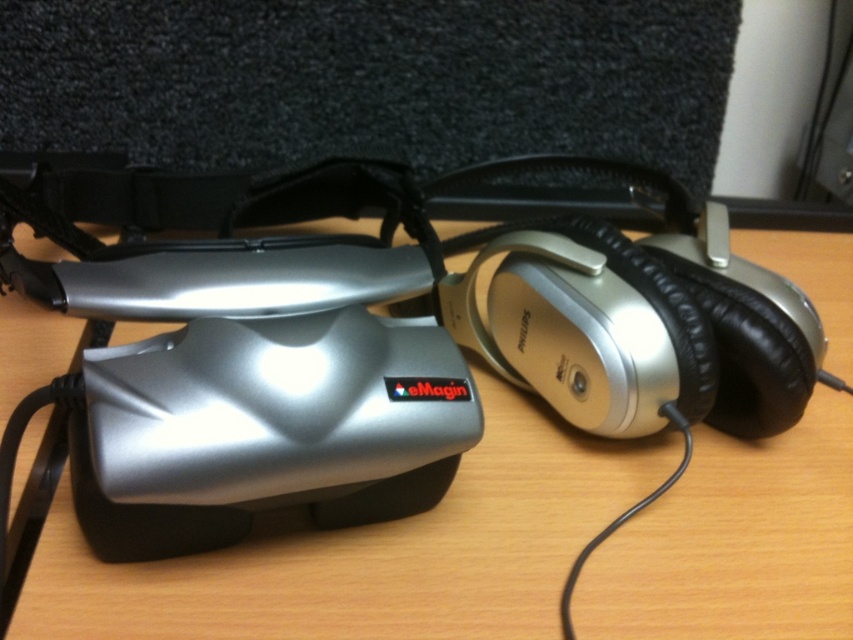
Question: Observing the image, what is the correct spatial positioning of wooden table at center in reference to silver metallic mouse at center-right?

Choices:
 (A) right
 (B) left

Answer: (A)

Question: Which point is closer to the camera?

Choices:
 (A) (521, 280)
 (B) (793, 628)

Answer: (B)

Question: Is wooden table at center closer to the viewer compared to silver metallic mouse at center-right?

Choices:
 (A) no
 (B) yes

Answer: (B)

Question: Can you confirm if wooden table at center is wider than silver metallic mouse at center-right?

Choices:
 (A) yes
 (B) no

Answer: (A)